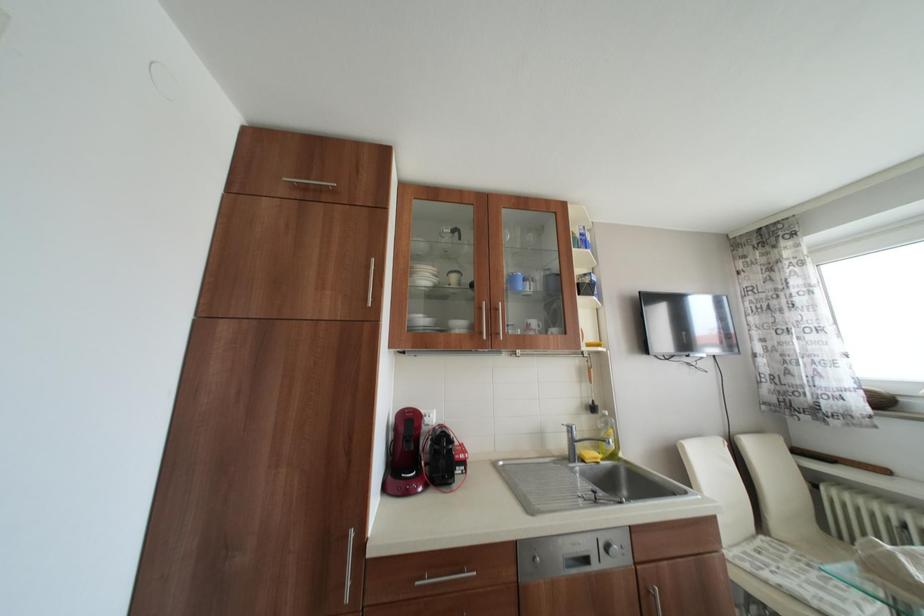
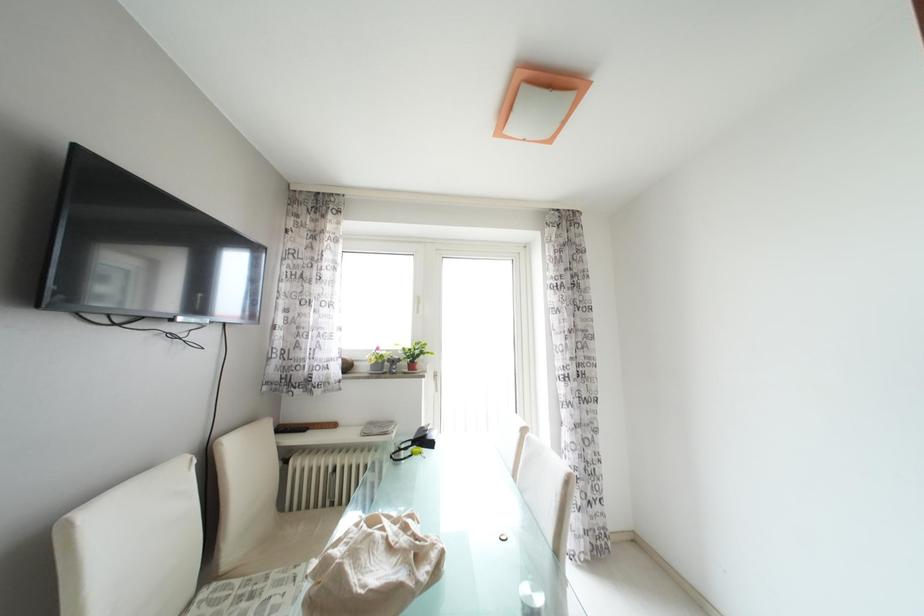
Question: The first image is from the beginning of the video and the second image is from the end. How did the camera likely rotate when shooting the video?

Choices:
 (A) Left
 (B) Right
 (C) Up
 (D) Down

Answer: (B)